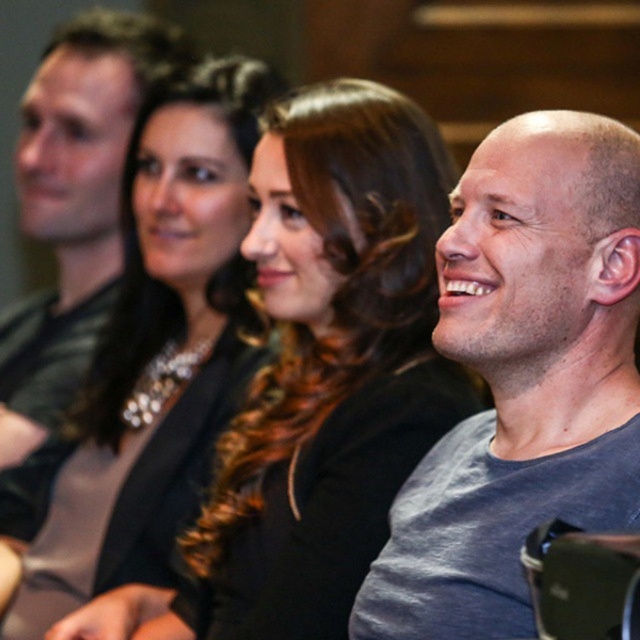
You are a fashion designer observing this image. You need to determine the spatial relationship between the matte black jacket at center and the black satin jacket at upper center. Which jacket is positioned higher in the image?

The black satin jacket at upper center is positioned higher than the matte black jacket at center.